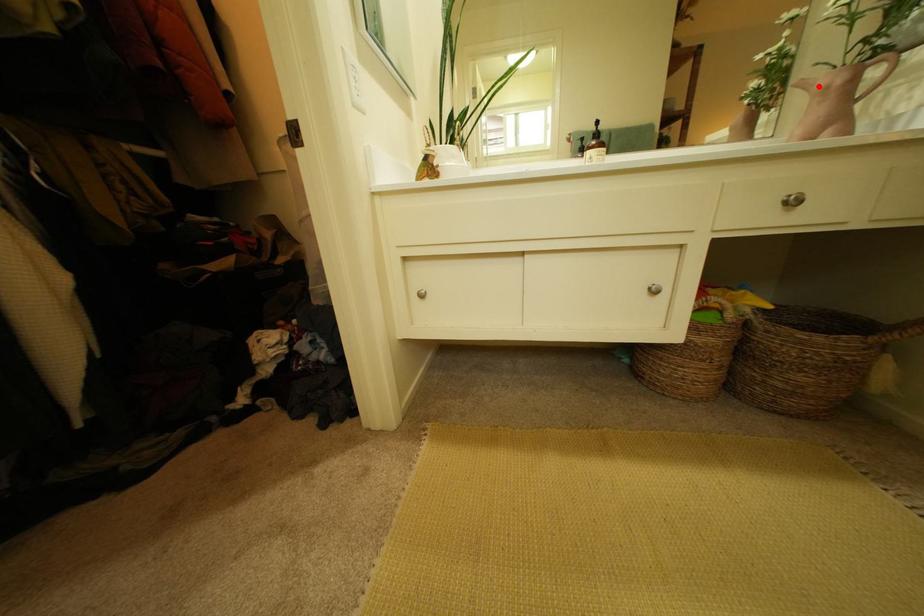
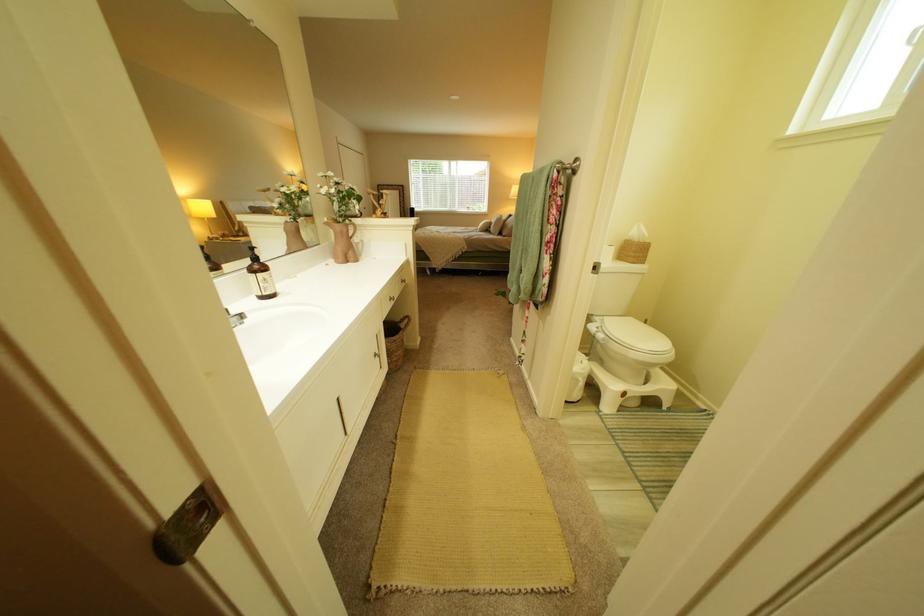
Question: I am providing you with two images of the same scene from different viewpoints. Image1 has a red point marked. In image2, the corresponding 3D location appears at what relative position? Reply with the corresponding letter.

Choices:
 (A) Closer
 (B) Farther

Answer: (A)